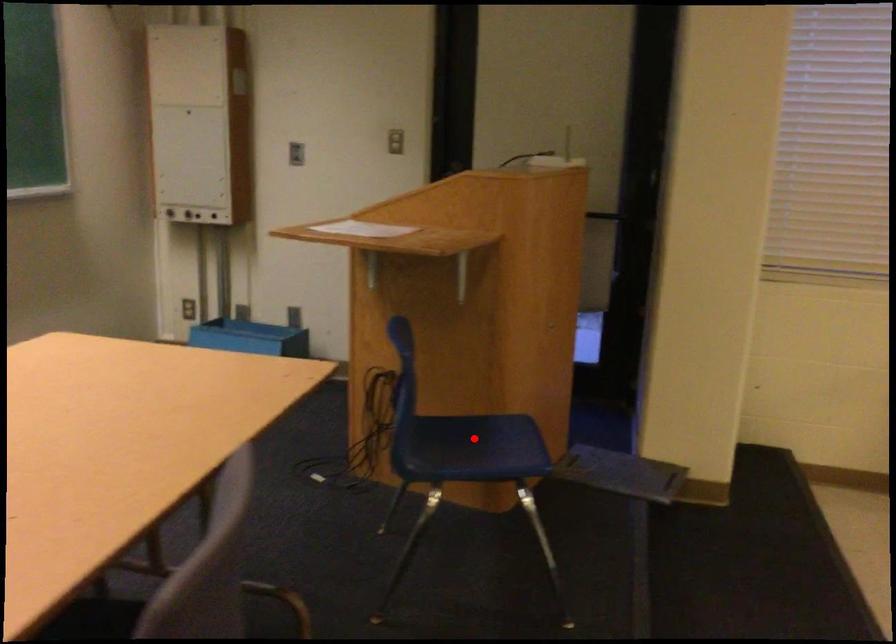
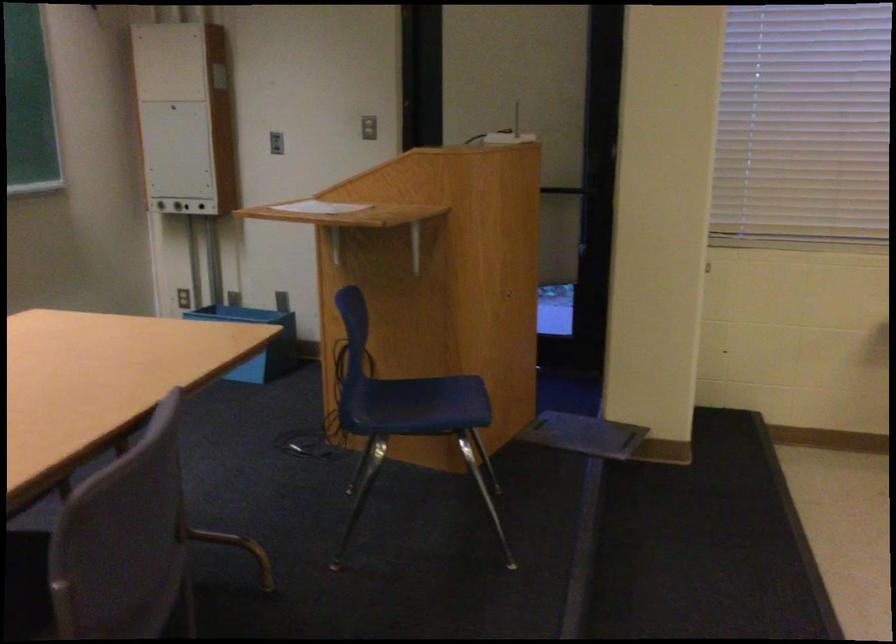
Where in the second image is the point corresponding to the highlighted location from the first image?

(424, 398)